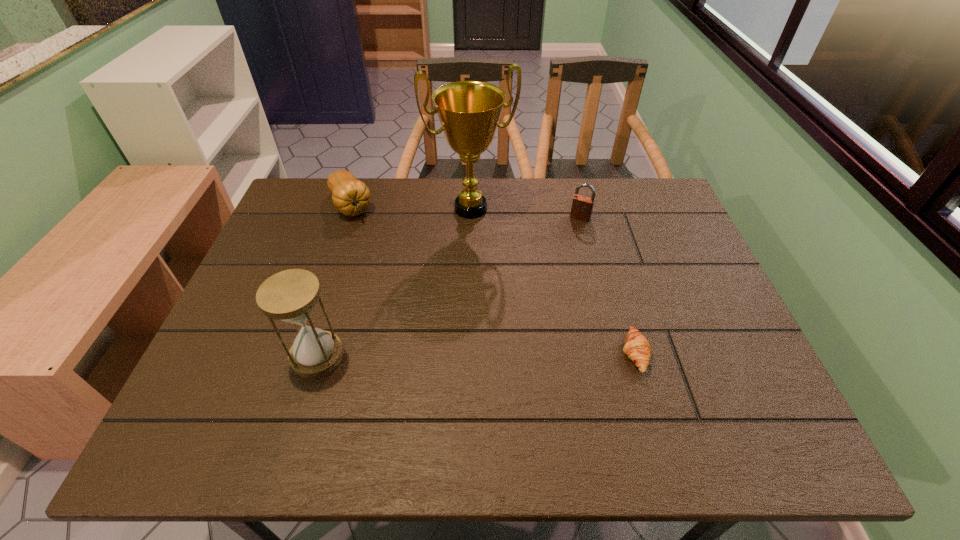
Locate an element on the screen. This screenshot has height=540, width=960. gourd situated at the far edge is located at coordinates (351, 197).

Locate an element on the screen. This screenshot has height=540, width=960. award positioned at the far edge is located at coordinates (469, 111).

Locate an element on the screen. The height and width of the screenshot is (540, 960). hourglass present at the near edge is located at coordinates (291, 295).

Where is `pastry at the near edge`? This screenshot has height=540, width=960. pastry at the near edge is located at coordinates (637, 348).

The height and width of the screenshot is (540, 960). I want to click on object present at the left edge, so click(351, 197).

Where is `object present at the far left corner`? Image resolution: width=960 pixels, height=540 pixels. object present at the far left corner is located at coordinates (351, 197).

At what (x,y) coordinates should I click in order to perform the action: click on vacant space at the far edge of the desktop. Please return your answer as a coordinate pair (x, y). The image size is (960, 540). Looking at the image, I should click on (584, 189).

In the image, there is a desktop. At what (x,y) coordinates should I click in order to perform the action: click on free space at the near edge. Please return your answer as a coordinate pair (x, y). Looking at the image, I should click on (406, 394).

In the image, there is a desktop. Where is `free space at the left edge`? The height and width of the screenshot is (540, 960). free space at the left edge is located at coordinates (297, 244).

Locate an element on the screen. This screenshot has width=960, height=540. vacant space at the right edge of the desktop is located at coordinates (656, 266).